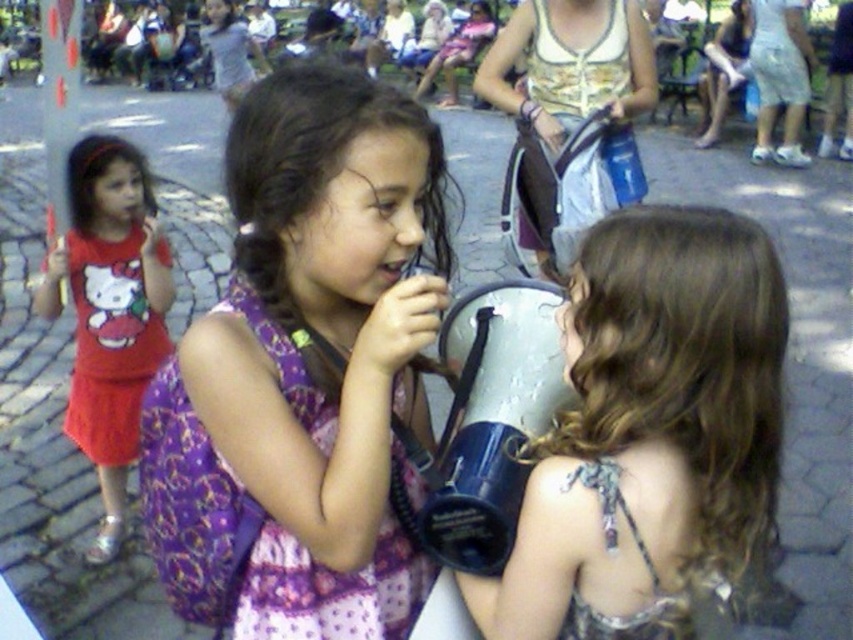
Can you confirm if purple satin dress at center is shorter than shiny silver megaphone at center?

No, purple satin dress at center is not shorter than shiny silver megaphone at center.

Can you confirm if purple satin dress at center is positioned below shiny silver megaphone at center?

Incorrect, purple satin dress at center is not positioned below shiny silver megaphone at center.

Identify the location of purple satin dress at center. (303, 371).

Image resolution: width=853 pixels, height=640 pixels. In order to click on purple satin dress at center in this screenshot , I will do `click(303, 371)`.

Does shiny silver megaphone at center have a larger size compared to matte red dress at left?

No, shiny silver megaphone at center is not bigger than matte red dress at left.

Can you confirm if shiny silver megaphone at center is positioned to the right of matte red dress at left?

Indeed, shiny silver megaphone at center is positioned on the right side of matte red dress at left.

What are the coordinates of `shiny silver megaphone at center` in the screenshot? It's located at (651, 435).

Is purple satin dress at center further to camera compared to matte red dress at left?

No, it is in front of matte red dress at left.

Can you confirm if purple satin dress at center is thinner than matte red dress at left?

Correct, purple satin dress at center's width is less than matte red dress at left's.

Measure the distance between point (241, 138) and camera.

1.16 meters

At what (x,y) coordinates should I click in order to perform the action: click on purple satin dress at center. Please return your answer as a coordinate pair (x, y). Looking at the image, I should click on (303, 371).